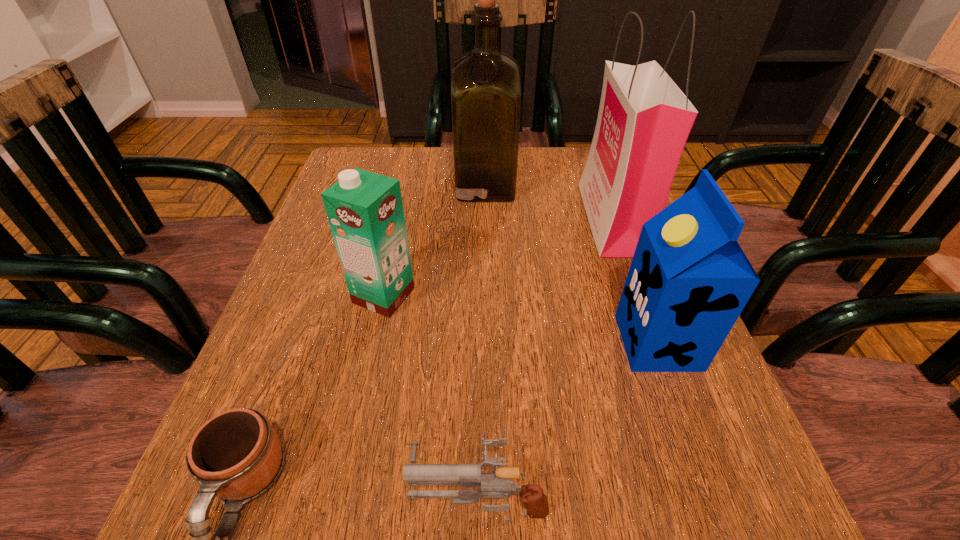
Locate which object is the third closest to the shopping bag. Please provide its 2D coordinates. Your answer should be formatted as a tuple, i.e. [(x, y)], where the tuple contains the x and y coordinates of a point satisfying the conditions above.

[(365, 211)]